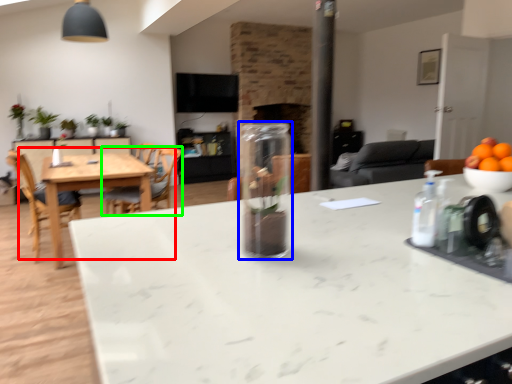
Question: Based on their relative distances, which object is nearer to kitchen & dining room table (highlighted by a red box)? Choose from glass vase (highlighted by a blue box) and chair (highlighted by a green box).

Choices:
 (A) glass vase
 (B) chair

Answer: (B)